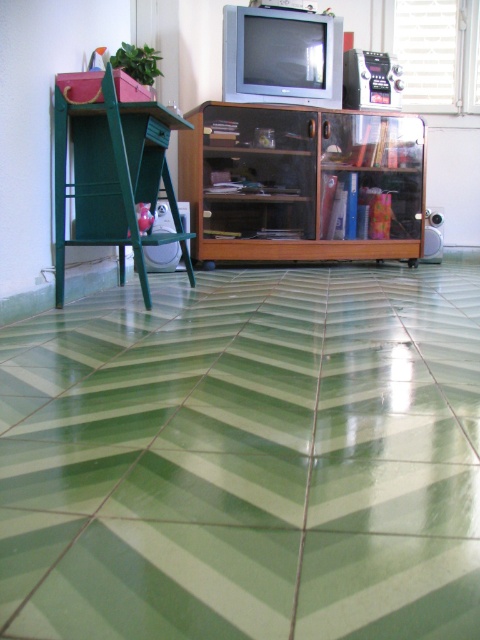
Which is in front, point (355, 365) or point (399, 115)?

Point (355, 365) is more forward.

This screenshot has height=640, width=480. Describe the element at coordinates (245, 458) in the screenshot. I see `green glossy tile at center` at that location.

Identify the location of green glossy tile at center. This screenshot has height=640, width=480. pos(245,458).

Who is positioned more to the left, green glossy tile at center or green matte stool at left?

green matte stool at left is more to the left.

Can you confirm if green glossy tile at center is smaller than green matte stool at left?

Incorrect, green glossy tile at center is not smaller in size than green matte stool at left.

Between point (450, 307) and point (75, 196), which one is positioned behind?

The point (450, 307) is behind.

At what (x,y) coordinates should I click in order to perform the action: click on green glossy tile at center. Please return your answer as a coordinate pair (x, y). The image size is (480, 640). Looking at the image, I should click on (245, 458).

Is wooden cabinet at center above green matte stool at left?

Correct, wooden cabinet at center is located above green matte stool at left.

Measure the distance between wooden cabinet at center and green matte stool at left.

A distance of 37.99 inches exists between wooden cabinet at center and green matte stool at left.

What do you see at coordinates (301, 182) in the screenshot? This screenshot has width=480, height=640. I see `wooden cabinet at center` at bounding box center [301, 182].

Identify the location of wooden cabinet at center. The image size is (480, 640). (301, 182).